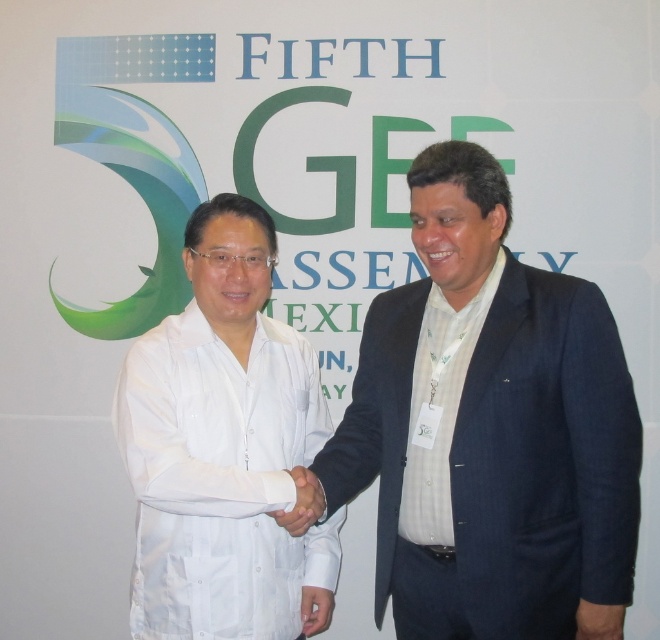
You are organizing a photo shoot and need to ensure that the dark blue suit at center and the white matte hand at center are visible in the frame. Based on their sizes, which object should you focus on to ensure both are fully captured?

The dark blue suit at center has a larger width than the white matte hand at center, so focusing on the dark blue suit at center will ensure both objects are fully visible in the frame.

Looking at the scene where two people are shaking hands in front of a formal backdrop, can you determine which object is positioned to the left of the other between the white matte shirt at center and the white matte hand at center?

The white matte shirt at center is positioned to the left of the white matte hand at center.